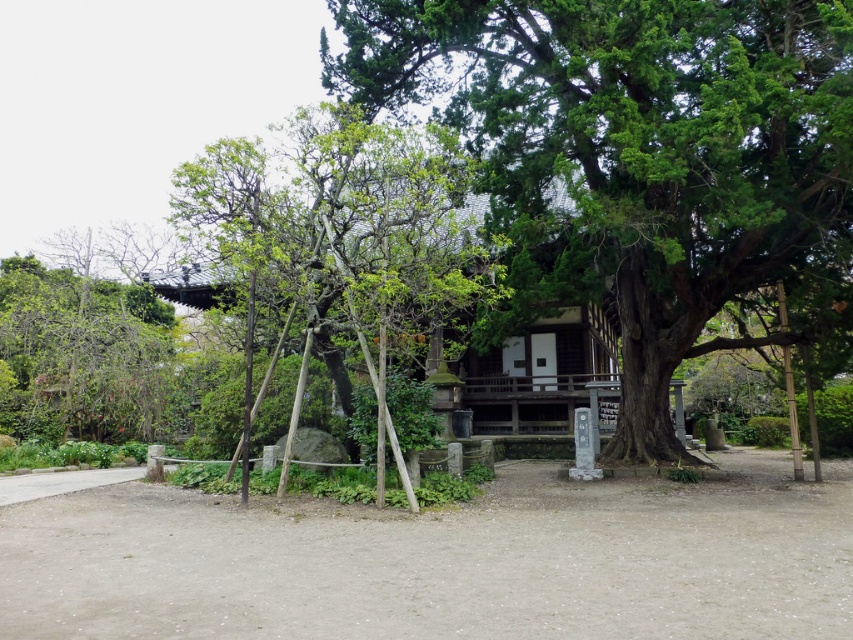
Question: Estimate the real-world distances between objects in this image. Which object is farther from the green textured tree at center?

Choices:
 (A) green leafy tree at left
 (B) green leafy tree at center

Answer: (A)

Question: Which point is closer to the camera?

Choices:
 (A) (22, 410)
 (B) (396, 278)
 (C) (543, 168)

Answer: (B)

Question: Is green leafy tree at center bigger than green leafy tree at left?

Choices:
 (A) yes
 (B) no

Answer: (A)

Question: Observing the image, what is the correct spatial positioning of green textured tree at center in reference to green leafy tree at left?

Choices:
 (A) below
 (B) above

Answer: (B)

Question: Is green leafy tree at center to the left of green leafy tree at left from the viewer's perspective?

Choices:
 (A) yes
 (B) no

Answer: (B)

Question: Estimate the real-world distances between objects in this image. Which object is farther from the green leafy tree at left?

Choices:
 (A) green textured tree at center
 (B) green leafy tree at center

Answer: (A)